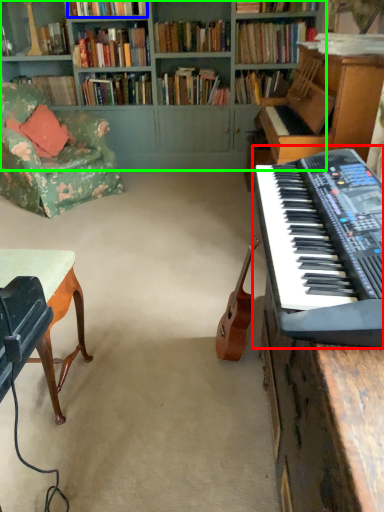
Question: Which object is positioned closest to musical keyboard (highlighted by a red box)? Select from book (highlighted by a blue box) and bookcase (highlighted by a green box).

Choices:
 (A) book
 (B) bookcase

Answer: (B)